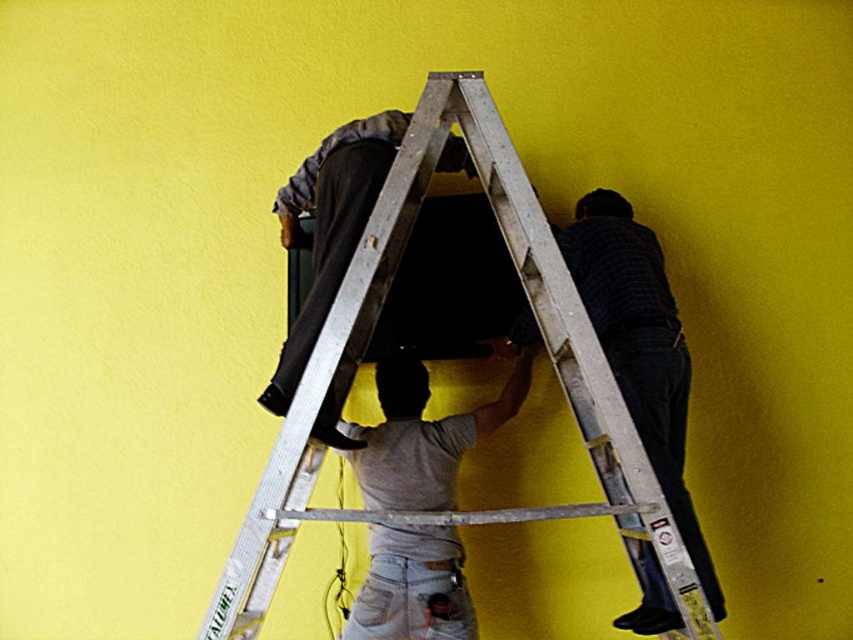
How far apart are dark gray fabric at upper right and matte black tv at center?

Answer: The distance of dark gray fabric at upper right from matte black tv at center is 20.75 inches.

Who is shorter, dark gray fabric at upper right or matte black tv at center?

With less height is matte black tv at center.

Which is behind, point (682, 448) or point (299, 374)?

The point (682, 448) is more distant.

You are a GUI agent. You are given a task and a screenshot of the screen. Output one action in this format:
    pyautogui.click(x=<x>, y=<y>)
    Task: Click on the dark gray fabric at upper right
    Image resolution: width=853 pixels, height=640 pixels.
    Given the screenshot: What is the action you would take?
    pyautogui.click(x=640, y=348)

Does silver metallic ladder at center come behind dark gray fabric at upper right?

No, it is not.

Who is more distant from viewer, (401, 150) or (611, 339)?

The point (611, 339) is behind.

Is point (216, 595) less distant than point (682, 452)?

That is True.

Where is `silver metallic ladder at center`? silver metallic ladder at center is located at coordinates (370, 333).

Does point (688, 500) come closer to viewer compared to point (379, 486)?

Yes, point (688, 500) is in front of point (379, 486).

Consider the image. Can you confirm if dark gray fabric at upper right is bigger than gray matte fabric at center?

Yes.

Which is in front, point (643, 348) or point (381, 627)?

Point (643, 348) is in front.

This screenshot has width=853, height=640. I want to click on dark gray fabric at upper right, so click(x=640, y=348).